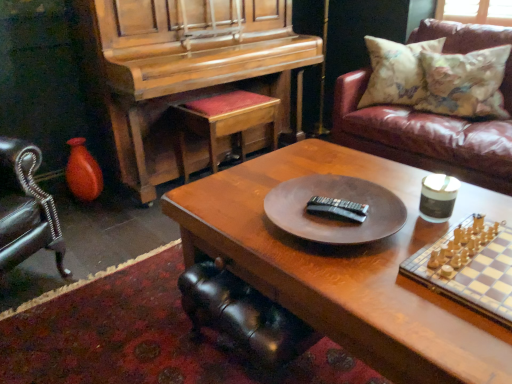
This screenshot has width=512, height=384. I want to click on free spot above wooden chessboard at right (from a real-world perspective), so click(x=474, y=264).